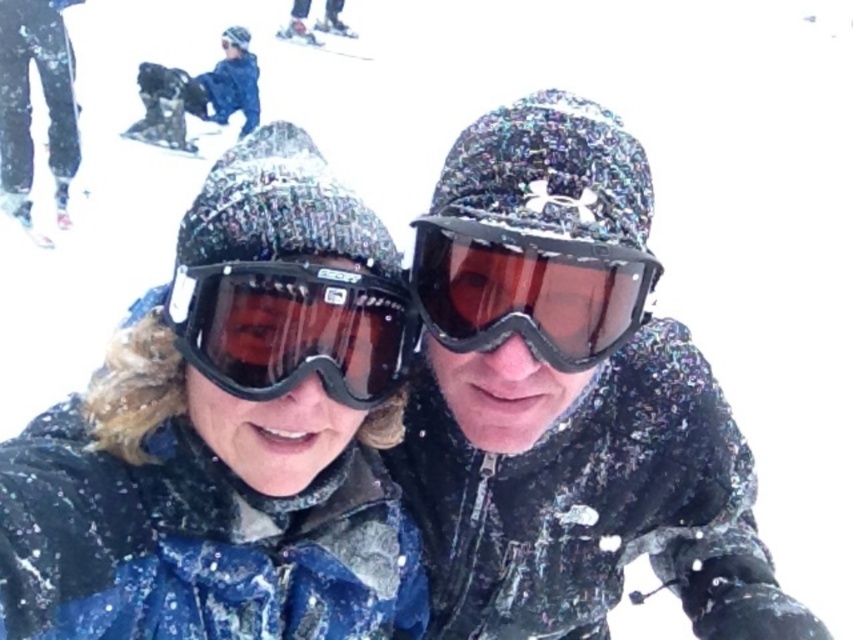
Question: Is matte black goggles at center to the left of matte black ski at left from the viewer's perspective?

Choices:
 (A) no
 (B) yes

Answer: (A)

Question: Considering the real-world distances, which object is farthest from the matte black ski at left?

Choices:
 (A) transparent plastic goggles at center
 (B) blue snowboard at upper left

Answer: (A)

Question: Which point is farther from the camera taking this photo?

Choices:
 (A) (289, 396)
 (B) (294, 40)

Answer: (B)

Question: Which point is closer to the camera?

Choices:
 (A) blue snowboard at upper left
 (B) transparent plastic goggles at center
 (C) matte blue jacket at center
 (D) matte black goggles at center

Answer: (C)

Question: Does transparent plastic goggles at center appear on the left side of matte black ski at left?

Choices:
 (A) yes
 (B) no

Answer: (B)

Question: Does matte black goggles at center have a smaller size compared to matte black ski at left?

Choices:
 (A) no
 (B) yes

Answer: (B)